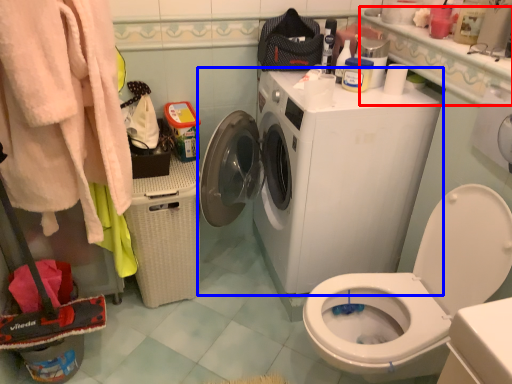
Question: Which object appears closest to the camera in this image, counter top (highlighted by a red box) or washing machine (highlighted by a blue box)?

Choices:
 (A) counter top
 (B) washing machine

Answer: (A)